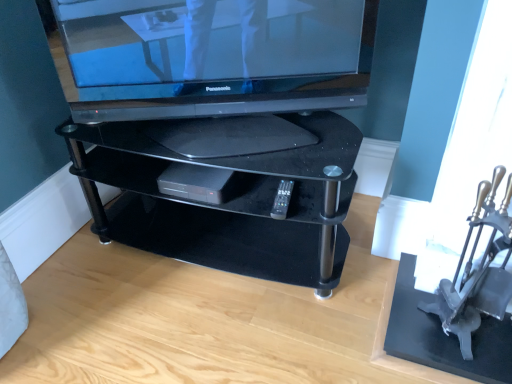
This screenshot has width=512, height=384. What do you see at coordinates (211, 56) in the screenshot?
I see `satin black television at upper center` at bounding box center [211, 56].

What do you see at coordinates (227, 202) in the screenshot? I see `black glass tv stand at center` at bounding box center [227, 202].

At what (x,y) coordinates should I click in order to perform the action: click on satin black television at upper center. Please return your answer as a coordinate pair (x, y). Looking at the image, I should click on (211, 56).

Considering the sizes of objects black glass tv stand at center and metallic silver armchair at right in the image provided, who is wider, black glass tv stand at center or metallic silver armchair at right?

With larger width is black glass tv stand at center.

Is there a large distance between black glass tv stand at center and metallic silver armchair at right?

That's not correct — black glass tv stand at center is a little close to metallic silver armchair at right.

Considering the relative positions of black glass tv stand at center and metallic silver armchair at right in the image provided, is black glass tv stand at center to the left of metallic silver armchair at right from the viewer's perspective?

Correct, you'll find black glass tv stand at center to the left of metallic silver armchair at right.

Does black glass tv stand at center have a larger size compared to metallic silver armchair at right?

Correct, black glass tv stand at center is larger in size than metallic silver armchair at right.

Locate an element on the screen. furniture that appears behind the satin black television at upper center is located at coordinates (227, 202).

Which object is thinner, satin black television at upper center or black glass tv stand at center?

satin black television at upper center.

From a real-world perspective, is satin black television at upper center positioned under black glass tv stand at center based on gravity?

No.

From the picture: What's the angular difference between satin black television at upper center and black glass tv stand at center's facing directions?

22 degrees separate the facing orientations of satin black television at upper center and black glass tv stand at center.

Does point (159, 58) appear closer or farther from the camera than point (461, 253)?

Clearly, point (159, 58) is closer to the camera than point (461, 253).

Would you say satin black television at upper center is a long distance from metallic silver armchair at right?

That's not correct — satin black television at upper center is a little close to metallic silver armchair at right.

Can you confirm if satin black television at upper center is wider than metallic silver armchair at right?

Indeed, satin black television at upper center has a greater width compared to metallic silver armchair at right.

Is metallic silver armchair at right to the left of satin black television at upper center from the viewer's perspective?

No.

From a real-world perspective, is metallic silver armchair at right physically below satin black television at upper center?

Yes, from a real-world perspective, metallic silver armchair at right is below satin black television at upper center.

Is metallic silver armchair at right inside the boundaries of satin black television at upper center, or outside?

The correct answer is: outside.

Does metallic silver armchair at right have a smaller size compared to satin black television at upper center?

Indeed, metallic silver armchair at right has a smaller size compared to satin black television at upper center.

From a real-world perspective, is black plastic remote at center on top of satin black television at upper center?

No.

Between black plastic remote at center and satin black television at upper center, which one has larger size?

satin black television at upper center is bigger.

Which object is positioned more to the right, black plastic remote at center or satin black television at upper center?

Positioned to the right is black plastic remote at center.

Would you say metallic silver armchair at right is to the left or to the right of black plastic dvd player at center in the picture?

Clearly, metallic silver armchair at right is on the right of black plastic dvd player at center in the image.

The image size is (512, 384). What are the coordinates of `gadget on the left of metallic silver armchair at right` in the screenshot? It's located at (194, 182).

From the image's perspective, which is above, metallic silver armchair at right or black plastic dvd player at center?

black plastic dvd player at center appears higher in the image.

Is metallic silver armchair at right not near black plastic dvd player at center?

They are positioned close to each other.

Consider the image. Is black glass tv stand at center at the left side of black plastic remote at center?

→ Correct, you'll find black glass tv stand at center to the left of black plastic remote at center.

I want to click on furniture that is under the black plastic remote at center (from a real-world perspective), so click(227, 202).

From a real-world perspective, which object rests below the other?

From a 3D spatial view, black glass tv stand at center is below.

From the image's perspective, between black glass tv stand at center and black plastic remote at center, which one is located above?

black glass tv stand at center, from the image's perspective.

Find the location of a particular element. The image size is (512, 384). furniture that is behind the metallic silver armchair at right is located at coordinates (227, 202).

I want to click on television in front of the black glass tv stand at center, so click(x=211, y=56).

Looking at the image, which one is located further to black plastic dvd player at center, satin black television at upper center or black glass tv stand at center?

satin black television at upper center is further to black plastic dvd player at center.

From the image, which object appears to be nearer to black plastic remote at center, black plastic dvd player at center or satin black television at upper center?

black plastic dvd player at center.

Which object lies nearer to the anchor point metallic silver armchair at right, black plastic remote at center or black glass tv stand at center?

Among the two, black plastic remote at center is located nearer to metallic silver armchair at right.

Consider the image. Based on their spatial positions, is metallic silver armchair at right or satin black television at upper center further from black plastic remote at center?

Among the two, metallic silver armchair at right is located further to black plastic remote at center.

Based on their spatial positions, is black plastic remote at center or black plastic dvd player at center closer to metallic silver armchair at right?

Based on the image, black plastic remote at center appears to be nearer to metallic silver armchair at right.

Which object lies nearer to the anchor point black glass tv stand at center, satin black television at upper center or black plastic dvd player at center?

black plastic dvd player at center is closer to black glass tv stand at center.

Estimate the real-world distances between objects in this image. Which object is further from metallic silver armchair at right, black glass tv stand at center or black plastic remote at center?

The object further to metallic silver armchair at right is black glass tv stand at center.

Based on their spatial positions, is metallic silver armchair at right or satin black television at upper center further from black plastic dvd player at center?

Based on the image, metallic silver armchair at right appears to be further to black plastic dvd player at center.

Where is `furniture between black plastic dvd player at center and black plastic remote at center`? furniture between black plastic dvd player at center and black plastic remote at center is located at coordinates (227, 202).

Image resolution: width=512 pixels, height=384 pixels. In order to click on furniture between satin black television at upper center and black plastic remote at center in the up-down direction in this screenshot , I will do `click(227, 202)`.

The height and width of the screenshot is (384, 512). I want to click on gadget between satin black television at upper center and black plastic remote at center in the vertical direction, so click(194, 182).

This screenshot has height=384, width=512. What are the coordinates of `remote situated between black plastic dvd player at center and metallic silver armchair at right from left to right` in the screenshot? It's located at (282, 200).